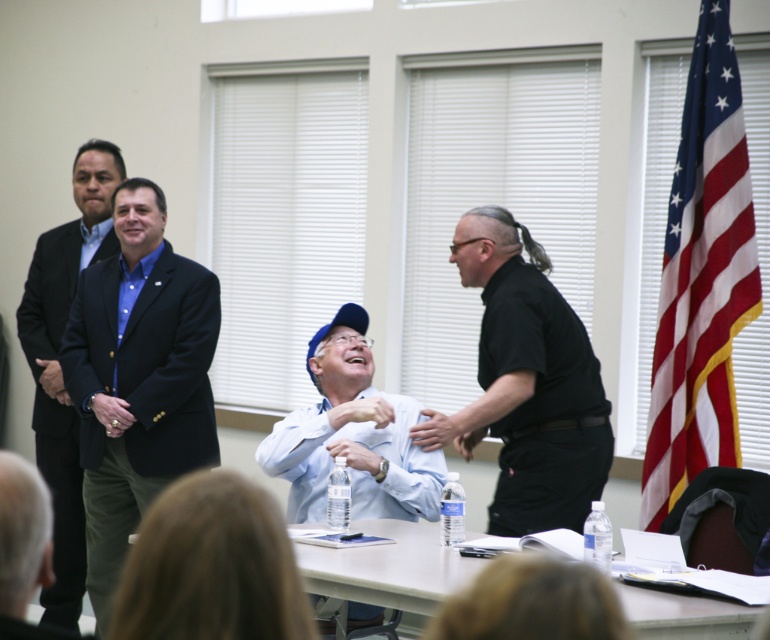
Between american flag at right and black matte shirt at right, which one has less height?

Standing shorter between the two is black matte shirt at right.

What are the coordinates of `american flag at right` in the screenshot? It's located at (701, 276).

Who is more distant from viewer, (673, 244) or (524, 388)?

Point (673, 244)

The height and width of the screenshot is (640, 770). Find the location of `american flag at right`. american flag at right is located at coordinates (701, 276).

Is matte black blazer at left to the left of white plastic table at lower center from the viewer's perspective?

Correct, you'll find matte black blazer at left to the left of white plastic table at lower center.

Image resolution: width=770 pixels, height=640 pixels. What do you see at coordinates (136, 378) in the screenshot?
I see `matte black blazer at left` at bounding box center [136, 378].

Is point (216, 304) in front of point (382, 563)?

No, (216, 304) is behind (382, 563).

Identify the location of matte black blazer at left. Image resolution: width=770 pixels, height=640 pixels. (136, 378).

Is black matte shirt at right below matte black suit at left?

No.

Can you confirm if black matte shirt at right is shorter than matte black suit at left?

Indeed, black matte shirt at right has a lesser height compared to matte black suit at left.

Does point (611, 448) lie in front of point (72, 292)?

Yes.

This screenshot has width=770, height=640. Find the location of `black matte shirt at right`. black matte shirt at right is located at coordinates (526, 385).